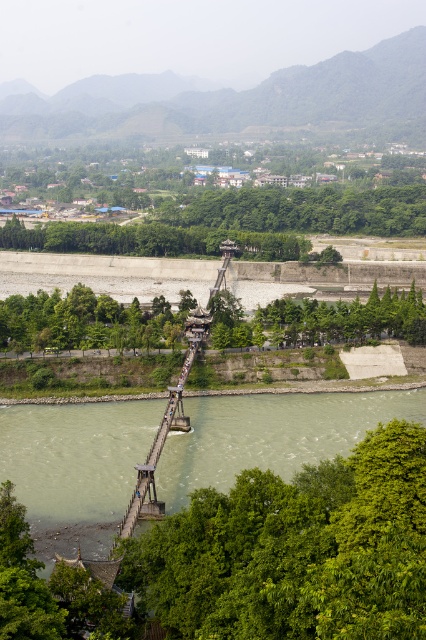
Is greenish-brown water at center taller than green leafy trees at center?

Correct, greenish-brown water at center is much taller as green leafy trees at center.

I want to click on greenish-brown water at center, so click(x=270, y=435).

Identify the location of greenish-brown water at center. Image resolution: width=426 pixels, height=640 pixels. (270, 435).

Does greenish-brown water at center lie behind green leafy tree at lower left?

No, greenish-brown water at center is in front of green leafy tree at lower left.

Does greenish-brown water at center have a lesser height compared to green leafy tree at lower left?

No, greenish-brown water at center is not shorter than green leafy tree at lower left.

Identify the location of greenish-brown water at center. (270, 435).

Is point (94, 300) less distant than point (420, 296)?

That is True.

Can you confirm if green leafy tree at lower left is bigger than green leafy trees at center?

No, green leafy tree at lower left is not bigger than green leafy trees at center.

Which is behind, point (92, 304) or point (296, 310)?

Point (92, 304)

Locate an element on the screen. This screenshot has height=640, width=426. green leafy tree at lower left is located at coordinates (83, 321).